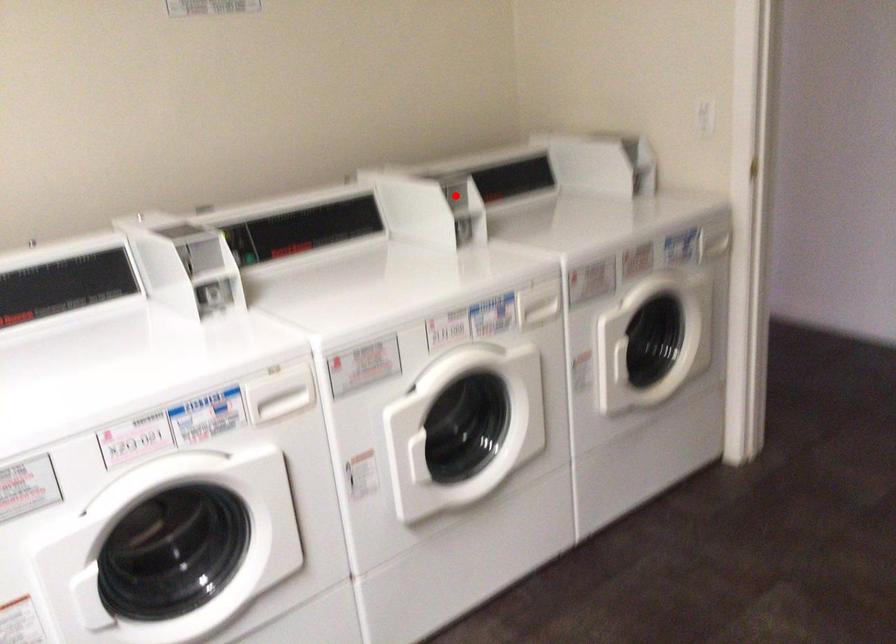
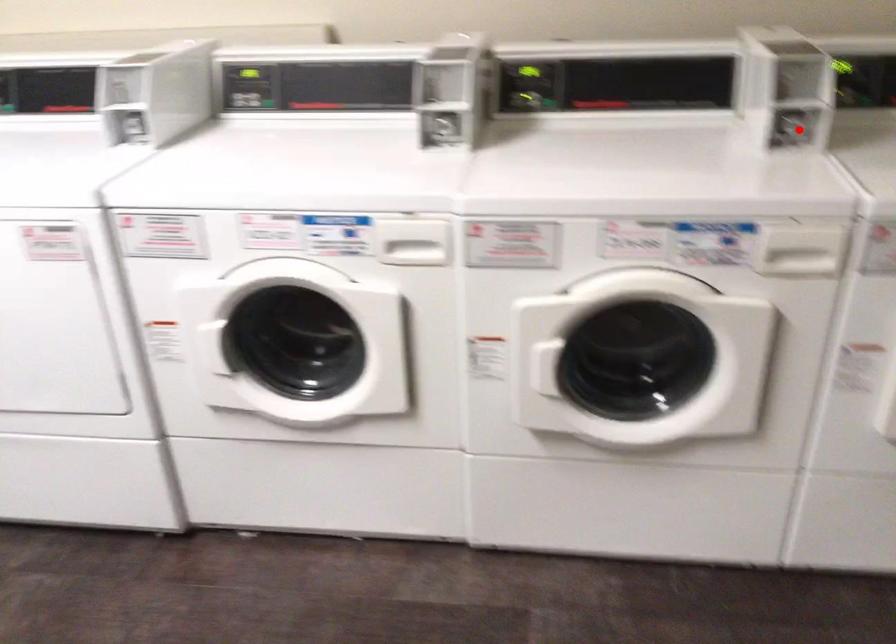
I am providing you with two images of the same scene from different viewpoints. A red point is marked on the first image and another point is marked on the second image. Do the highlighted points in image1 and image2 indicate the same real-world spot?

No